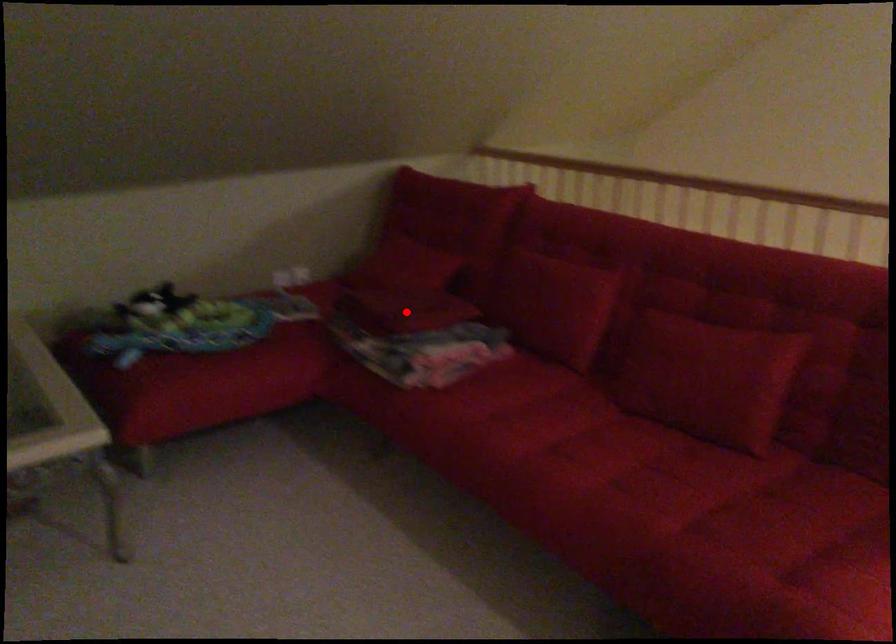
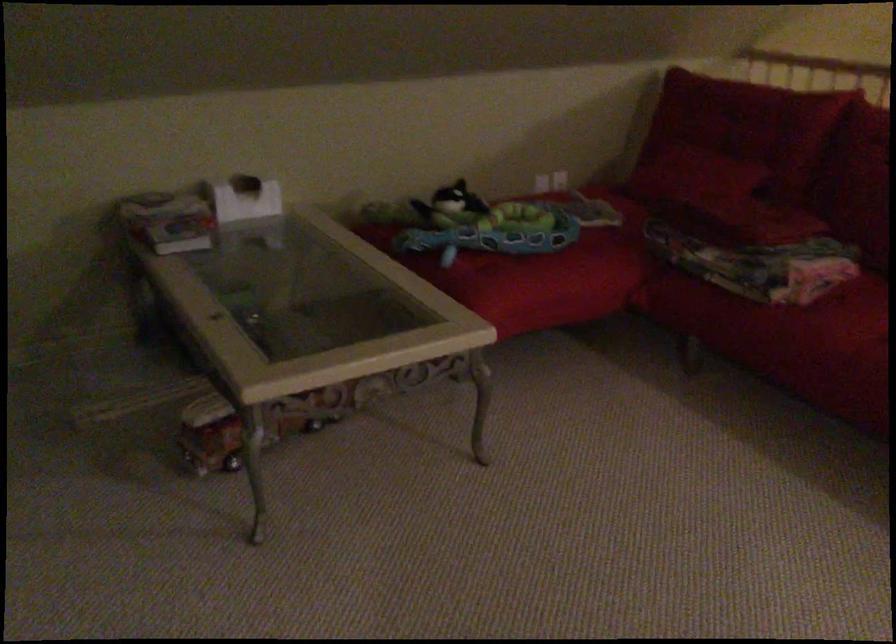
Find the pixel in the second image that matches the highlighted location in the first image.

(761, 220)